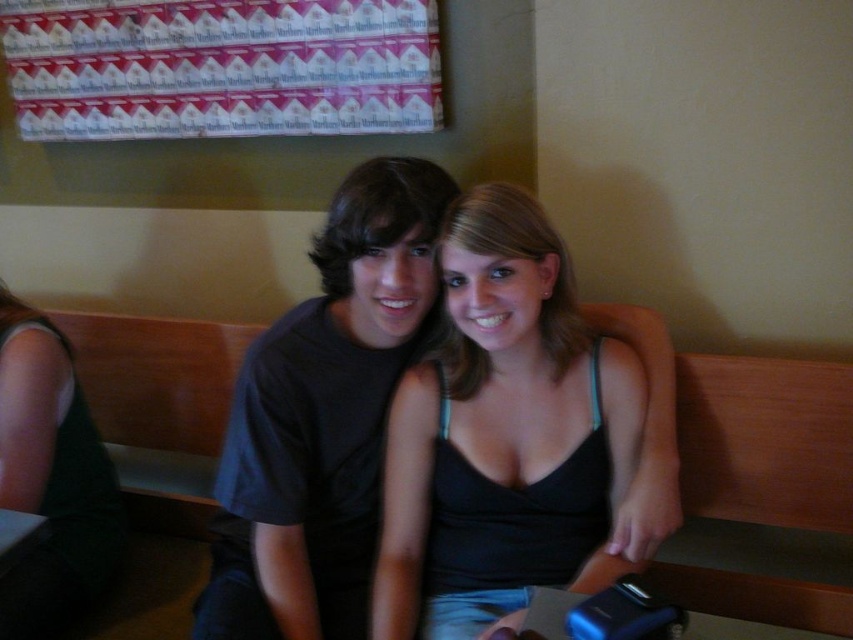
Question: Which object is positioned closest to the black matte tank top at center?

Choices:
 (A) dark gray t-shirt at center
 (B) wooden bench at center

Answer: (A)

Question: Can you confirm if black matte tank top at center is positioned to the right of dark gray t-shirt at center?

Choices:
 (A) no
 (B) yes

Answer: (B)

Question: Does black matte tank top at center appear on the left side of dark gray t-shirt at center?

Choices:
 (A) yes
 (B) no

Answer: (B)

Question: Among these objects, which one is nearest to the camera?

Choices:
 (A) wooden bench at center
 (B) dark gray t-shirt at center
 (C) black matte tank top at center

Answer: (C)

Question: Among these objects, which one is farthest from the camera?

Choices:
 (A) black matte tank top at center
 (B) dark gray t-shirt at center
 (C) wooden bench at center

Answer: (C)

Question: Is dark gray t-shirt at center to the right of wooden bench at center from the viewer's perspective?

Choices:
 (A) no
 (B) yes

Answer: (A)